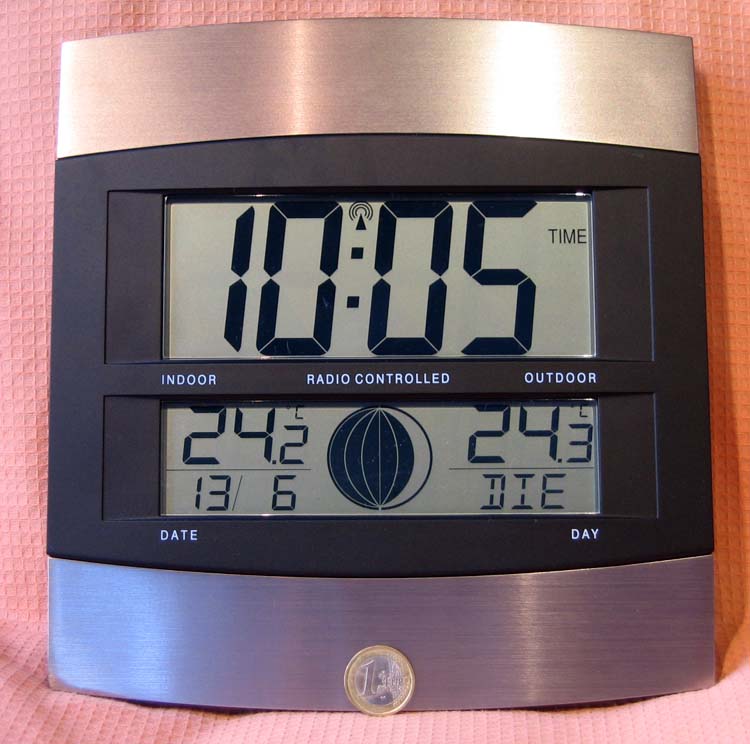
This screenshot has height=744, width=750. Identify the location of digital screen. (445, 487), (538, 307).